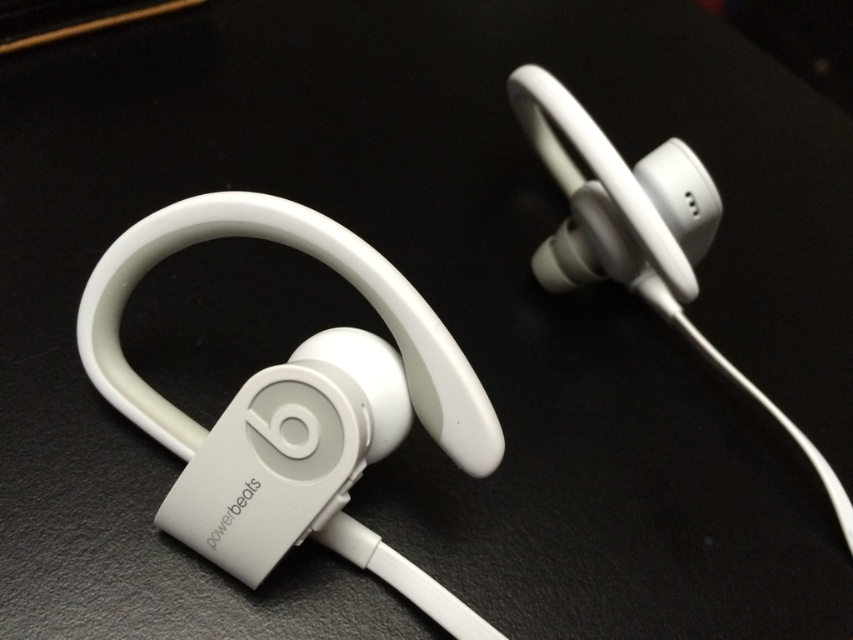
Is white matte earphone at center to the right of white matte earphone at upper center from the viewer's perspective?

In fact, white matte earphone at center is to the left of white matte earphone at upper center.

Describe the element at coordinates (614, 198) in the screenshot. I see `white matte earphone at center` at that location.

Describe the element at coordinates (614, 198) in the screenshot. I see `white matte earphone at center` at that location.

Locate an element on the screen. This screenshot has height=640, width=853. white matte earphone at center is located at coordinates (614, 198).